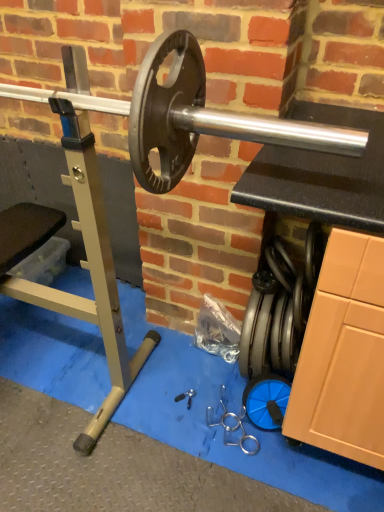
Question: Are silver metallic barbell at center and metallic silver tool at center beside each other?

Choices:
 (A) no
 (B) yes

Answer: (A)

Question: Is silver metallic barbell at center wider than metallic silver tool at center?

Choices:
 (A) no
 (B) yes

Answer: (B)

Question: Considering the relative sizes of silver metallic barbell at center and metallic silver tool at center in the image provided, is silver metallic barbell at center taller than metallic silver tool at center?

Choices:
 (A) yes
 (B) no

Answer: (A)

Question: Considering the relative positions of silver metallic barbell at center and metallic silver tool at center in the image provided, is silver metallic barbell at center to the right of metallic silver tool at center from the viewer's perspective?

Choices:
 (A) no
 (B) yes

Answer: (A)

Question: From a real-world perspective, is silver metallic barbell at center physically below metallic silver tool at center?

Choices:
 (A) no
 (B) yes

Answer: (A)

Question: Is silver metallic barbell at center not close to metallic silver tool at center?

Choices:
 (A) yes
 (B) no

Answer: (A)

Question: Is silver metallic barbell at center at the back of metallic silver tool at center?

Choices:
 (A) yes
 (B) no

Answer: (B)

Question: From the image's perspective, is metallic silver tool at center on silver metallic barbell at center?

Choices:
 (A) no
 (B) yes

Answer: (A)

Question: Can you confirm if metallic silver tool at center is shorter than silver metallic barbell at center?

Choices:
 (A) no
 (B) yes

Answer: (B)

Question: Is metallic silver tool at center bigger than silver metallic barbell at center?

Choices:
 (A) yes
 (B) no

Answer: (B)

Question: Is metallic silver tool at center smaller than silver metallic barbell at center?

Choices:
 (A) yes
 (B) no

Answer: (A)

Question: Are metallic silver tool at center and silver metallic barbell at center far apart?

Choices:
 (A) no
 (B) yes

Answer: (B)

Question: Looking at their shapes, would you say silver metallic barbell at center is wider or thinner than metallic silver tool at center?

Choices:
 (A) thin
 (B) wide

Answer: (B)